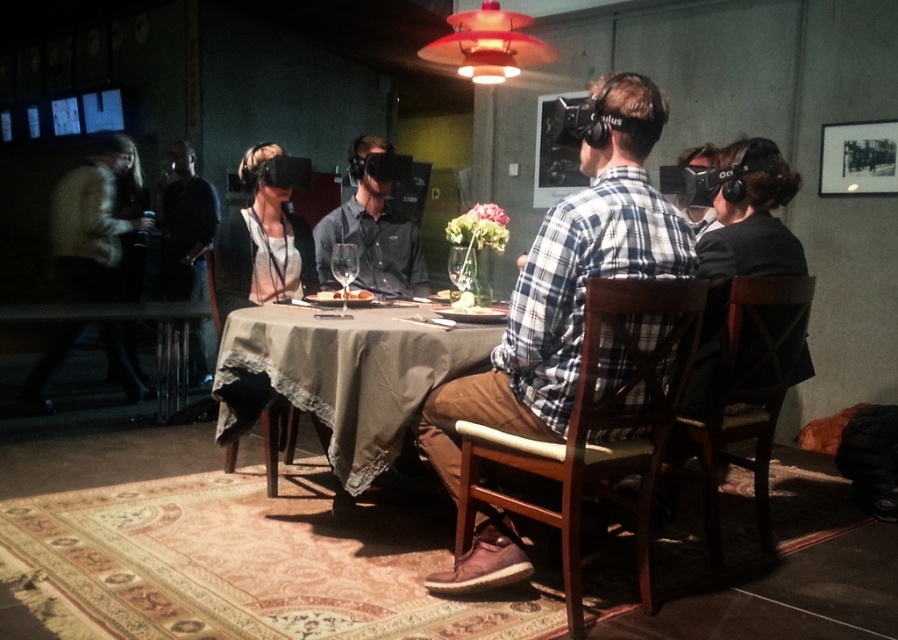
You are a server in a restaurant. You need to place a 12 inch tall cake on the table. The cake is wrapped in a box that adds an extra 2 inches to its height. Can the cake be placed on the brown fabric table at center without it touching the black leather jacket at left?

The brown fabric table at center is not as tall as the black leather jacket at left. Since the cake with its box is 14 inches tall, it would exceed the table height and potentially touch the jacket. Therefore, the cake cannot be placed safely on the table.

You are a photographer trying to capture a candid shot of the people at the table. Since you want to ensure both the plaid shirt at center and the black leather jacket at left are clearly visible in the photo, which object should you focus on first to ensure depth of field?

The plaid shirt at center is much taller than the black leather jacket at left, so focusing on the plaid shirt at center first will ensure both are in focus due to its greater distance from the camera.